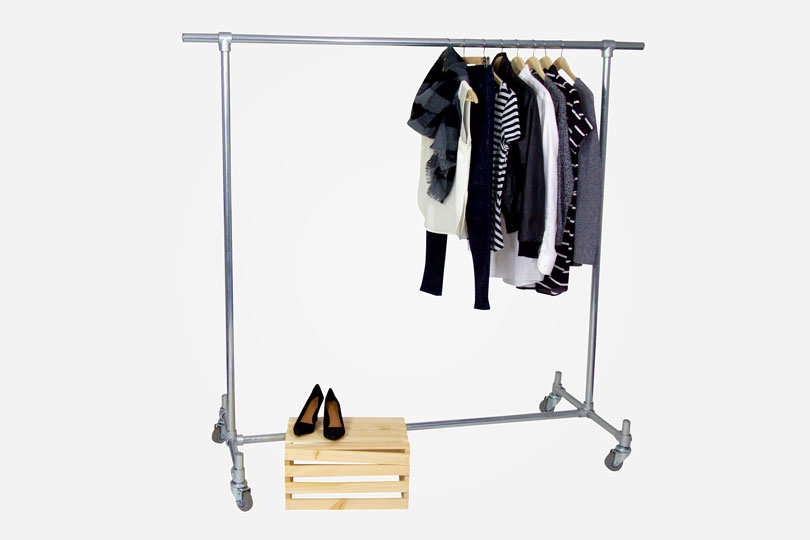
Where is `clothes hangers`? clothes hangers is located at coordinates (450, 70), (470, 57), (502, 87), (501, 68), (519, 63), (535, 63), (548, 62), (565, 64).